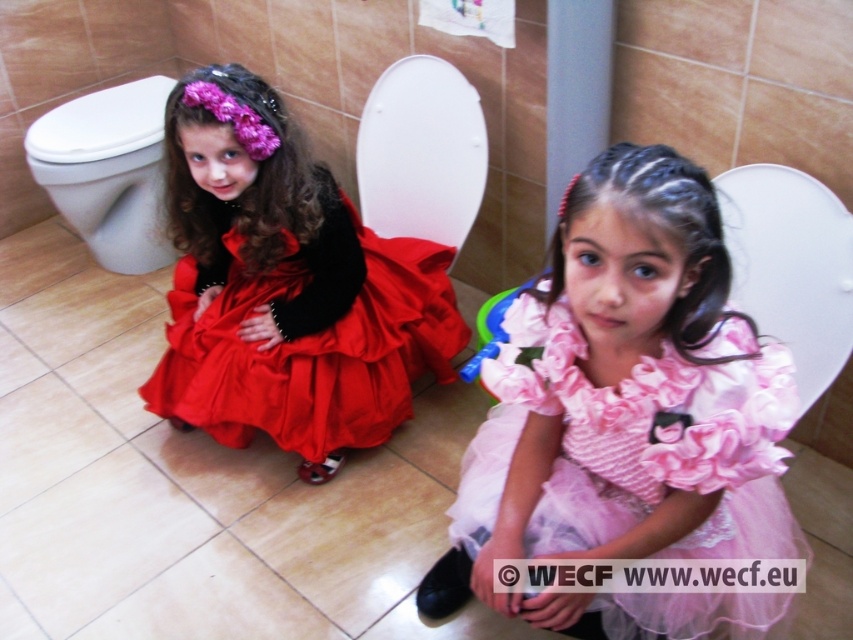
Can you confirm if pink satin dress at center is taller than matte satin dress at left?

No, pink satin dress at center is not taller than matte satin dress at left.

Is point (703, 499) less distant than point (300, 365)?

Yes.

What do you see at coordinates (628, 417) in the screenshot?
I see `pink satin dress at center` at bounding box center [628, 417].

Find the location of a particular element. Image resolution: width=853 pixels, height=640 pixels. pink satin dress at center is located at coordinates (628, 417).

Locate an element on the screen. matte satin dress at left is located at coordinates (286, 288).

Which is more to the left, matte satin dress at left or white glossy toilet bowl at left?

white glossy toilet bowl at left is more to the left.

You are a GUI agent. You are given a task and a screenshot of the screen. Output one action in this format:
    pyautogui.click(x=<x>, y=<y>)
    Task: Click on the matte satin dress at left
    
    Given the screenshot: What is the action you would take?
    pyautogui.click(x=286, y=288)

At what (x,y) coordinates should I click in order to perform the action: click on matte satin dress at left. Please return your answer as a coordinate pair (x, y). The height and width of the screenshot is (640, 853). Looking at the image, I should click on (286, 288).

Is point (552, 381) closer to viewer compared to point (161, 195)?

Yes.

Who is positioned more to the left, pink satin dress at center or white glossy toilet bowl at left?

white glossy toilet bowl at left is more to the left.

You are a GUI agent. You are given a task and a screenshot of the screen. Output one action in this format:
    pyautogui.click(x=<x>, y=<y>)
    Task: Click on the pink satin dress at center
    This screenshot has height=640, width=853.
    Given the screenshot: What is the action you would take?
    pyautogui.click(x=628, y=417)

Locate an element on the screen. The image size is (853, 640). pink satin dress at center is located at coordinates (628, 417).